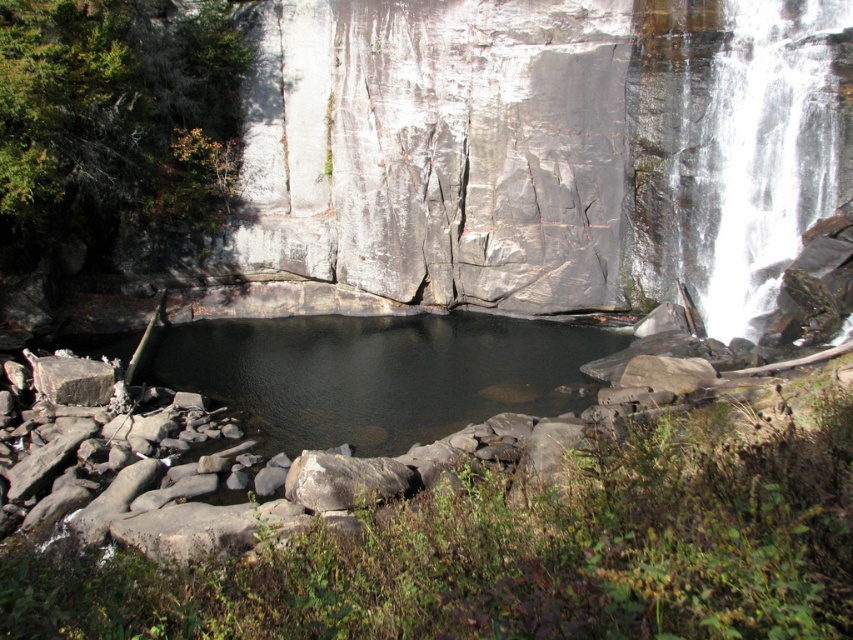
Which of these two, dark gray water at center or gray rough stone at lower left, stands taller?

dark gray water at center is taller.

Is point (448, 372) positioned before point (51, 388)?

That is False.

Between point (578, 364) and point (54, 396), which one is positioned in front?

Point (54, 396) is in front.

You are a GUI agent. You are given a task and a screenshot of the screen. Output one action in this format:
    pyautogui.click(x=<x>, y=<y>)
    Task: Click on the dark gray water at center
    
    Given the screenshot: What is the action you would take?
    pyautogui.click(x=376, y=372)

Is dark gray water at center wider than gray rough rock at center?

Yes, dark gray water at center is wider than gray rough rock at center.

How far apart are dark gray water at center and gray rough rock at center?

A distance of 8.10 meters exists between dark gray water at center and gray rough rock at center.

Find the location of a particular element. dark gray water at center is located at coordinates (376, 372).

Who is taller, white frothy water at upper right or gray rough rock at center?

Standing taller between the two is white frothy water at upper right.

Does white frothy water at upper right have a lesser height compared to gray rough rock at center?

Incorrect, white frothy water at upper right's height does not fall short of gray rough rock at center's.

Does point (746, 28) come farther from viewer compared to point (396, 476)?

Yes, it is behind point (396, 476).

Locate an element on the screen. The image size is (853, 640). white frothy water at upper right is located at coordinates (738, 145).